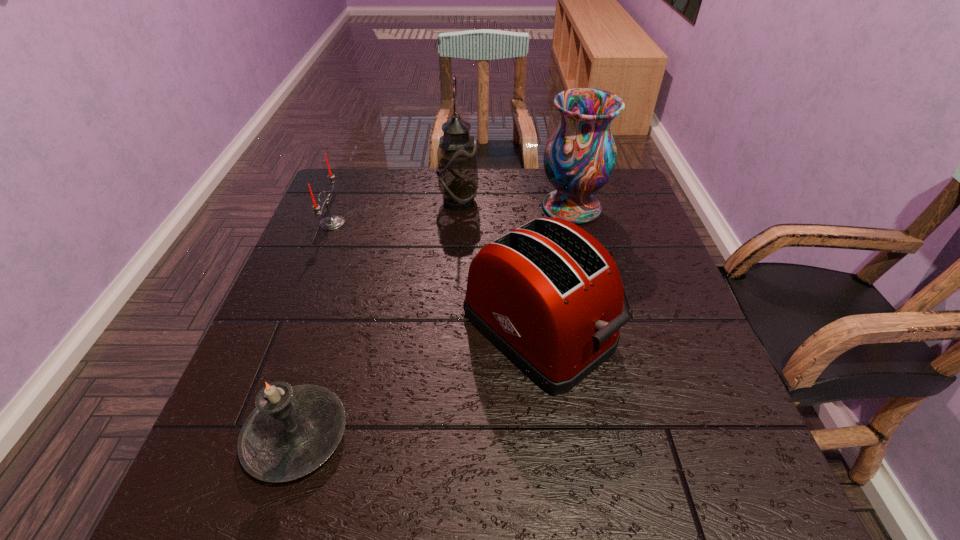
Where is `vacant space at the left edge`? The width and height of the screenshot is (960, 540). vacant space at the left edge is located at coordinates (327, 250).

In the image, there is a desktop. Identify the location of vacant space at the right edge. The height and width of the screenshot is (540, 960). (634, 261).

The image size is (960, 540). Find the location of `free space at the far left corner of the desktop`. free space at the far left corner of the desktop is located at coordinates (336, 188).

The height and width of the screenshot is (540, 960). In the image, there is a desktop. In order to click on vacant space at the near left corner in this screenshot , I will do `click(256, 484)`.

The width and height of the screenshot is (960, 540). In order to click on vacant space at the far right corner of the desktop in this screenshot , I will do `click(608, 198)`.

This screenshot has width=960, height=540. What are the coordinates of `free space between the third shortest object and the farther candle` in the screenshot? It's located at (435, 276).

In order to click on vacant area that lies between the second tallest object and the nearer candle in this screenshot , I will do `click(434, 322)`.

Where is `free space between the oil lamp and the vase`? free space between the oil lamp and the vase is located at coordinates (515, 205).

Where is `free space between the farther candle and the fourth shortest object`? This screenshot has width=960, height=540. free space between the farther candle and the fourth shortest object is located at coordinates (452, 215).

Identify the location of vacant point located between the nearer candle and the farther candle. This screenshot has width=960, height=540. (315, 330).